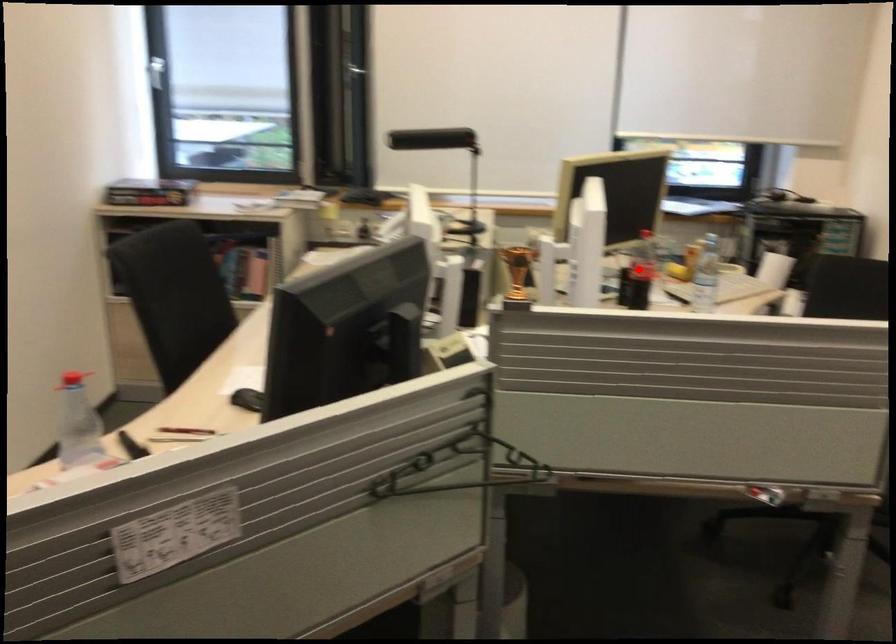
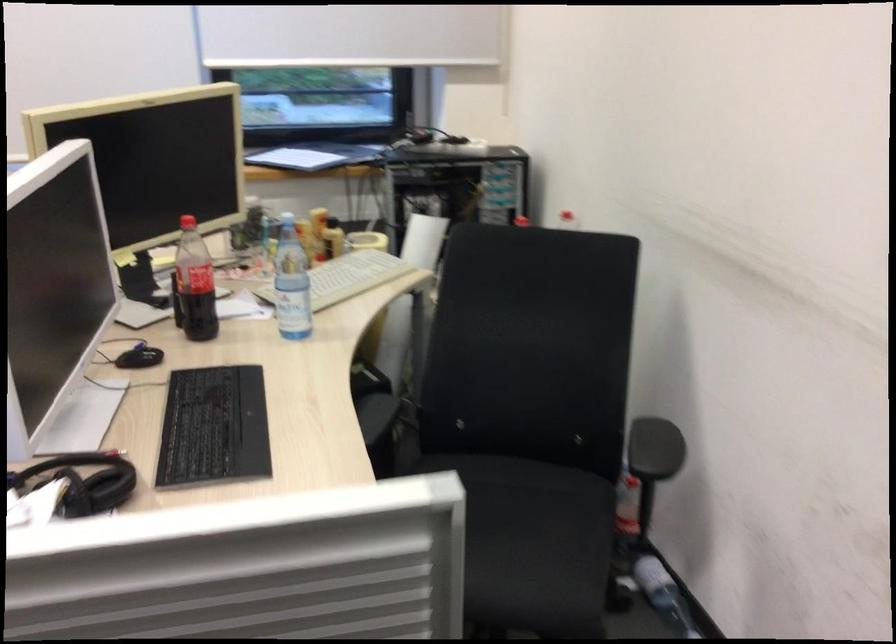
Question: I am providing you with two images of the same scene from different viewpoints. A red point is shown in image1. For the corresponding object point in image2, is it positioned nearer or farther from the camera?

Choices:
 (A) Nearer
 (B) Farther

Answer: (A)